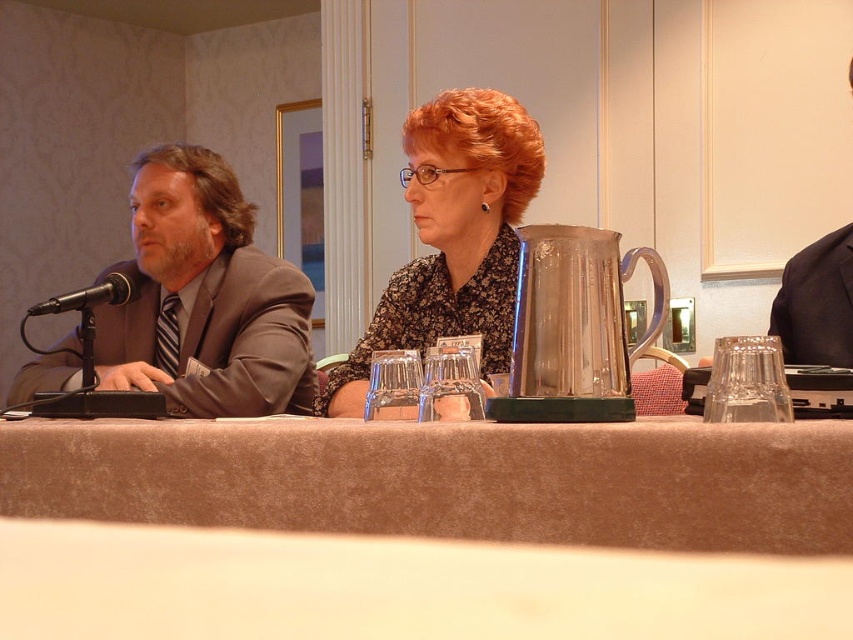
In the scene shown: You are a photographer standing in front of the brown fabric table at center and want to ensure your camera is positioned at exactly 80 centimeters away. Based on the scene provided, is your current position correct?

The distance of brown fabric table at center from camera is 80.45 centimeters, so your current position is slightly too close by 0.45 centimeters. Move back a bit to reach the desired distance.

You are a photographer adjusting your camera to focus on two specific points in the image. The first point is at coordinate point (447, 200) and the second is at coordinate point (113, 285). Which point is closer to the camera?

Point (447, 200) is closer to the camera than point (113, 285) because it is further to the viewer in the image.

In the scene shown: You are attending a meeting and need to pass a document to the person wearing the dark blue fabric business suit at right. The black metallic microphone at left is in your way. Can you move around the microphone to reach them?

Yes, because the dark blue fabric business suit at right is to the right of the black metallic microphone at left, so you can move around the microphone on the right side to reach them.